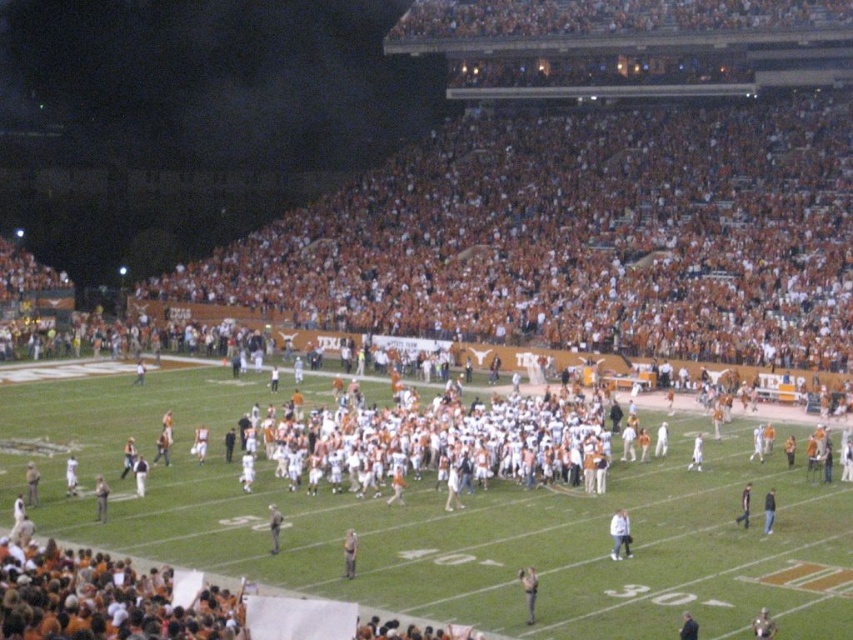
You are standing at the point labeled point (x=616, y=545) in the football stadium. You want to take a photo of the entire field. The camera you have can capture a scene up to 150 feet away. Will the camera be able to capture the entire field from your current position?

The distance between point (x=616, y=545) and the camera is 147.02 feet, which is within the camera maximum range of 150 feet. Therefore, the camera can capture the entire field from your current position.

You are a photographer positioned at the camera. You want to capture a closeup shot of the white cotton shirt at center. Given that your camera has a maximum zoom range of 30 meters, can you achieve this without moving closer?

The white cotton shirt at center and camera are 38.62 meters apart from each other, so the distance exceeds the camera maximum zoom range of 30 meters. Therefore, you cannot capture the closeup shot without moving closer.